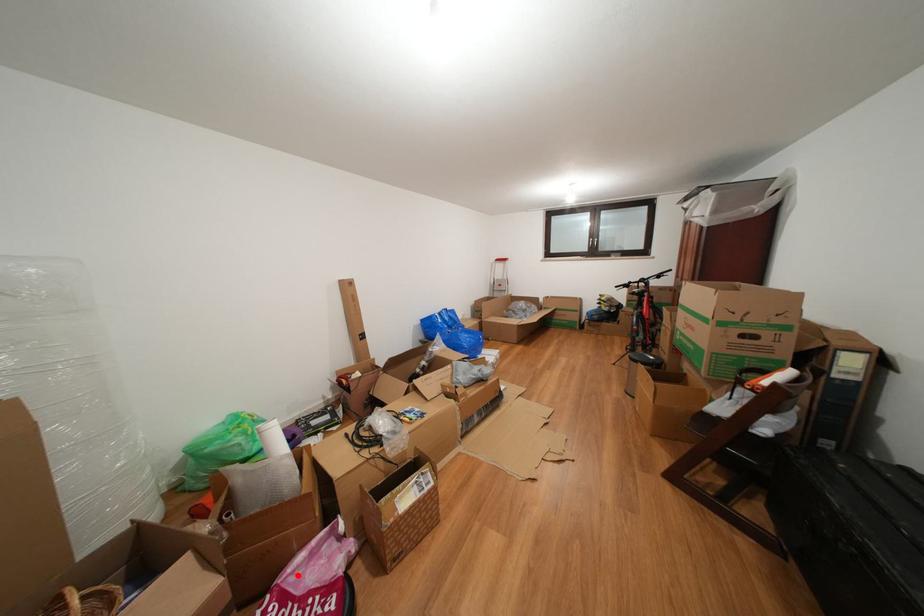
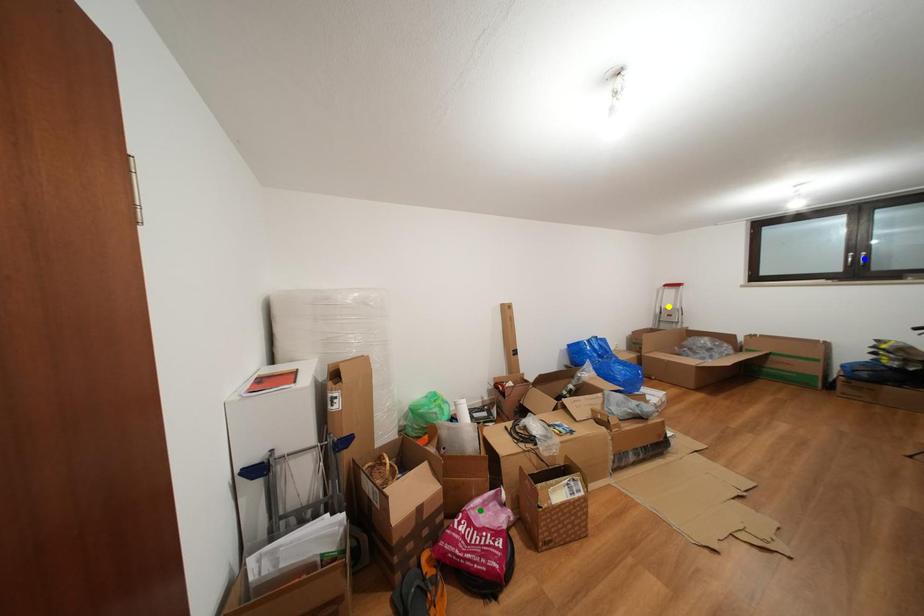
Question: I am providing you with two images of the same scene from different viewpoints. A red point is marked on the first image. You are given multiple points on the second image. Which point in image 2 is actually the same real-world point as the red point in image 1?

Choices:
 (A) yellow point
 (B) green point
 (C) blue point

Answer: (B)